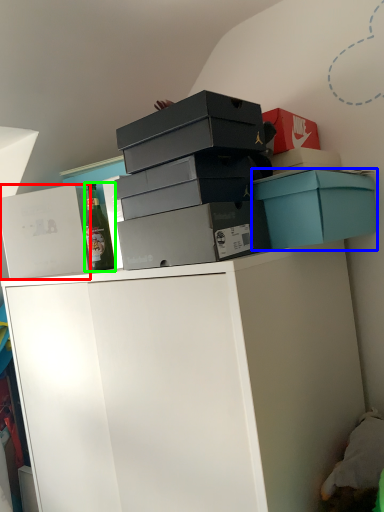
Question: Estimate the real-world distances between objects in this image. Which object is farther from box (highlighted by a red box), box (highlighted by a blue box) or bottle (highlighted by a green box)?

Choices:
 (A) box
 (B) bottle

Answer: (A)